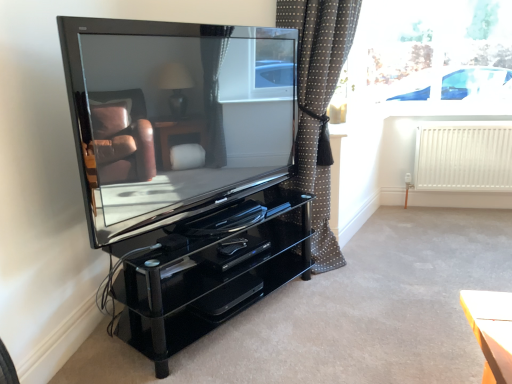
Where is `vacant space underneath white matte radiator at right (from a real-world perspective)`? The width and height of the screenshot is (512, 384). vacant space underneath white matte radiator at right (from a real-world perspective) is located at coordinates (455, 212).